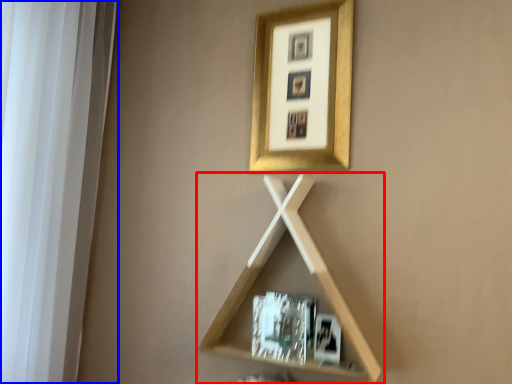
Question: Which object appears farthest to the camera in this image, shelf (highlighted by a red box) or window frame (highlighted by a blue box)?

Choices:
 (A) shelf
 (B) window frame

Answer: (A)